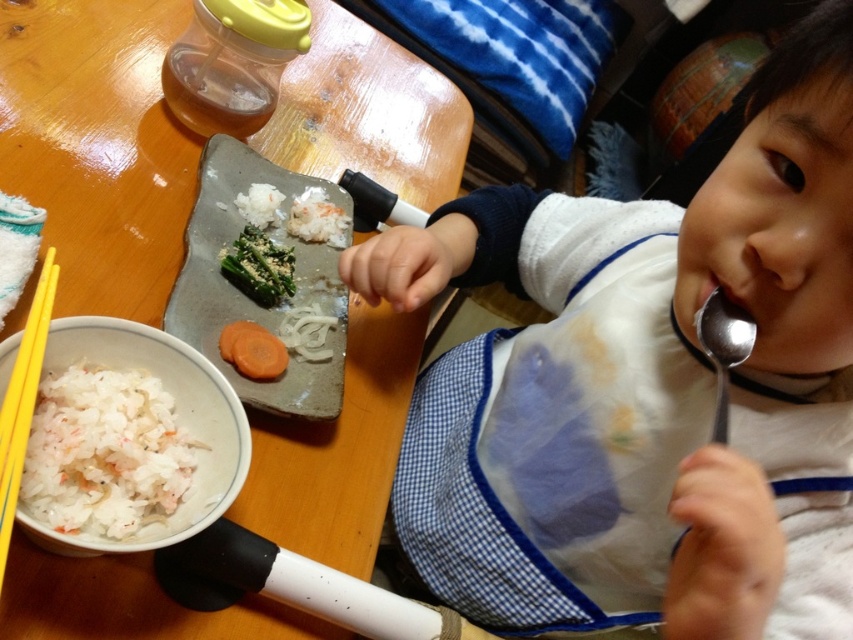
Can you confirm if white rice at lower left is positioned below sliced orange carrot at center?

Indeed, white rice at lower left is positioned under sliced orange carrot at center.

Can you confirm if white rice at lower left is thinner than sliced orange carrot at center?

Correct, white rice at lower left's width is less than sliced orange carrot at center's.

Is point (85, 388) behind point (274, 262)?

No, (85, 388) is closer to viewer.

Locate an element on the screen. This screenshot has width=853, height=640. white rice at lower left is located at coordinates (105, 452).

Between white rice at lower left and gray stone tray at center, which one has less height?

With less height is white rice at lower left.

Is white rice at lower left to the left of gray stone tray at center from the viewer's perspective?

Yes, white rice at lower left is to the left of gray stone tray at center.

What do you see at coordinates (105, 452) in the screenshot? Image resolution: width=853 pixels, height=640 pixels. I see `white rice at lower left` at bounding box center [105, 452].

Find the location of a particular element. This screenshot has height=640, width=853. white rice at lower left is located at coordinates (105, 452).

Does white fabric bib at center have a greater width compared to wooden table at center?

Incorrect, white fabric bib at center's width does not surpass wooden table at center's.

Locate an element on the screen. white fabric bib at center is located at coordinates (646, 387).

Where is `white fabric bib at center`? white fabric bib at center is located at coordinates (x=646, y=387).

Identify the location of white fabric bib at center. (646, 387).